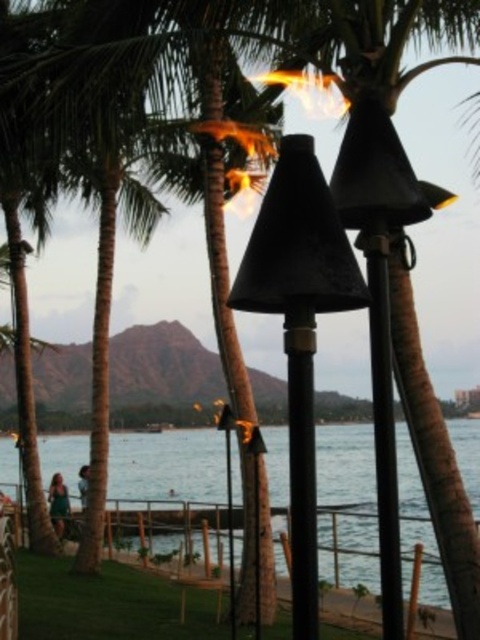
You are a maintenance worker checking the coastal scene. You need to determine if the black matte tiki torch at center is attached to the black metal pole at center. Based on the scene description, can you confirm this?

The black matte tiki torch at center is positioned over black metal pole at center, which indicates that it is likely attached to the pole.

You are standing at the point with coordinates point (370, 243) and want to walk towards the point with coordinates point (308, 454). Which direction should you move in relation to the tiki torches?

You should move towards the point (308, 454), which is in front of the point (370, 243). Since the tiki torches are in the foreground, moving towards the point (308, 454) would mean walking towards the direction where the tiki torches are located.

You are standing at the point marked as point (300, 324) in the coastal scene. What object are you standing on?

You are standing on the black matte tiki torch at center, as the point (300, 324) corresponds to this object.